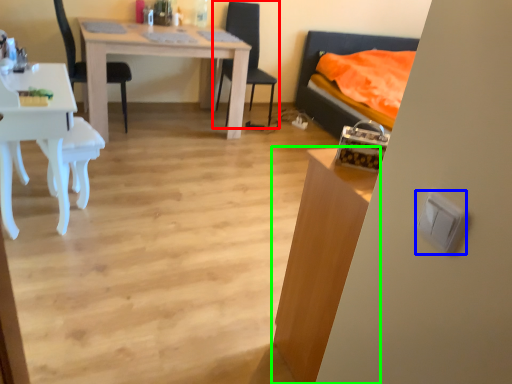
Question: Estimate the real-world distances between objects in this image. Which object is farther from chair (highlighted by a red box), light switch (highlighted by a blue box) or table (highlighted by a green box)?

Choices:
 (A) light switch
 (B) table

Answer: (A)